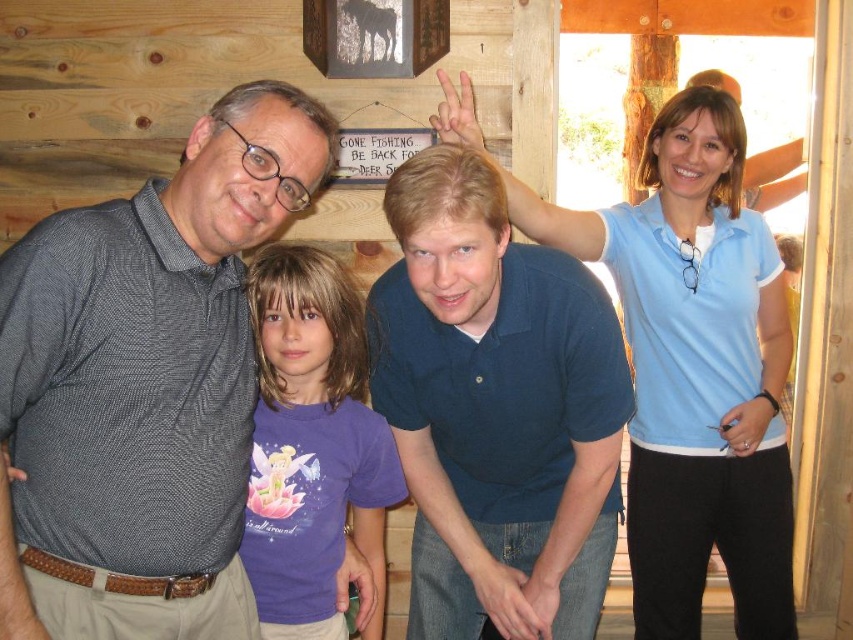
Question: Is dark blue polo shirt at center positioned before purple cotton shirt at center?

Choices:
 (A) no
 (B) yes

Answer: (B)

Question: Which object is closer to the camera taking this photo?

Choices:
 (A) purple cotton shirt at center
 (B) dark blue polo shirt at center

Answer: (B)

Question: Can you confirm if matte gray shirt at left is positioned above dark blue polo shirt at center?

Choices:
 (A) no
 (B) yes

Answer: (B)

Question: Estimate the real-world distances between objects in this image. Which object is farther from the dark blue polo shirt at center?

Choices:
 (A) purple cotton shirt at center
 (B) matte gray shirt at left

Answer: (B)

Question: Which point appears closest to the camera in this image?

Choices:
 (A) (64, 257)
 (B) (447, 490)
 (C) (277, 291)

Answer: (A)

Question: Does matte gray shirt at left have a greater width compared to purple cotton shirt at center?

Choices:
 (A) no
 (B) yes

Answer: (B)